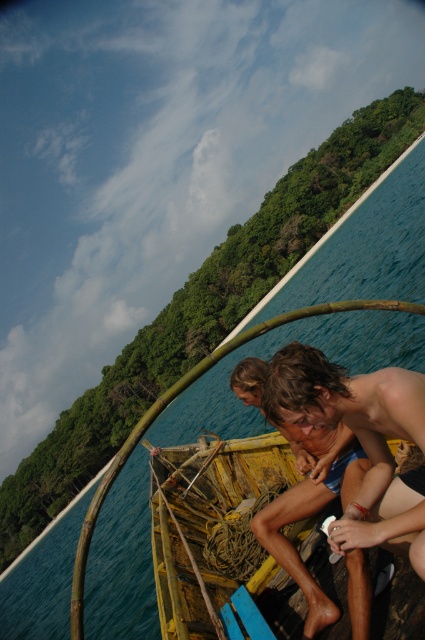
Question: Where is yellow weathered wood boat at center located in relation to shiny brown hair at center in the image?

Choices:
 (A) right
 (B) left

Answer: (B)

Question: Among these points, which one is nearest to the camera?

Choices:
 (A) (218, 490)
 (B) (367, 454)

Answer: (B)

Question: Is yellow weathered wood boat at center thinner than shiny brown hair at center?

Choices:
 (A) no
 (B) yes

Answer: (A)

Question: Can you confirm if yellow weathered wood boat at center is wider than shiny brown hair at center?

Choices:
 (A) no
 (B) yes

Answer: (B)

Question: Among these objects, which one is nearest to the camera?

Choices:
 (A) yellow weathered wood boat at center
 (B) shiny brown hair at center

Answer: (B)